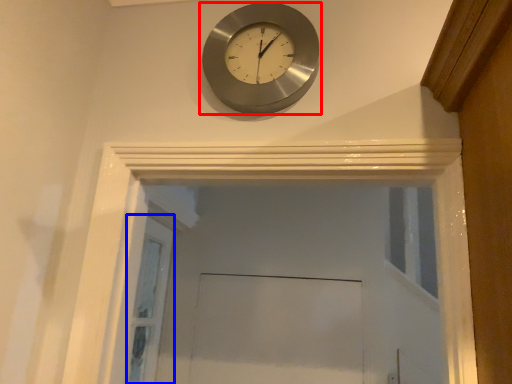
Question: Which point is closer to the camera, wall clock (highlighted by a red box) or screen door (highlighted by a blue box)?

Choices:
 (A) wall clock
 (B) screen door

Answer: (A)